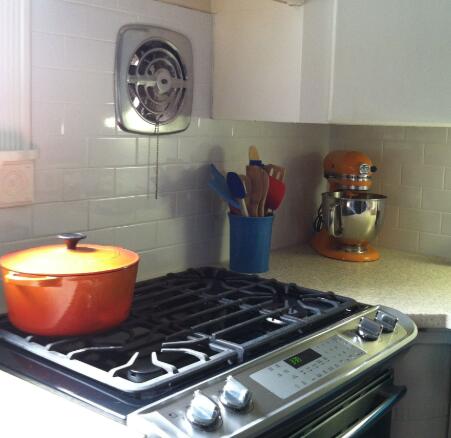
This screenshot has height=438, width=451. I want to click on fan, so pos(158,99).